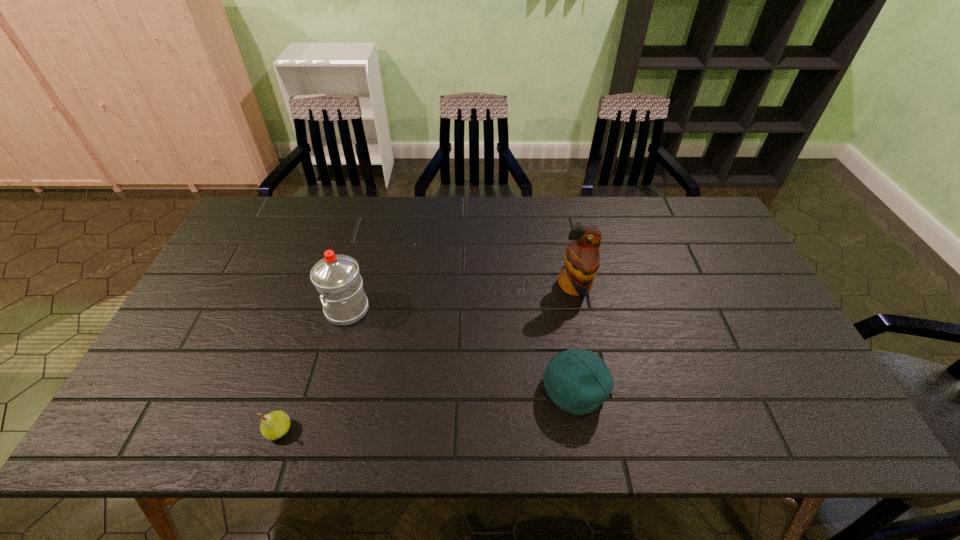
The width and height of the screenshot is (960, 540). In order to click on beanie located at the near edge in this screenshot , I will do `click(578, 381)`.

You are a GUI agent. You are given a task and a screenshot of the screen. Output one action in this format:
    pyautogui.click(x=<x>, y=<y>)
    Task: Click on the pear located at the near edge
    The width and height of the screenshot is (960, 540).
    Given the screenshot: What is the action you would take?
    pyautogui.click(x=276, y=424)

Image resolution: width=960 pixels, height=540 pixels. In order to click on vacant region at the far edge in this screenshot , I will do `click(597, 226)`.

In the image, there is a desktop. At what (x,y) coordinates should I click in order to perform the action: click on blank space at the near edge. Please return your answer as a coordinate pair (x, y). Looking at the image, I should click on (529, 407).

Locate an element on the screen. free space at the left edge of the desktop is located at coordinates (202, 332).

The image size is (960, 540). I want to click on free space at the right edge, so click(x=791, y=382).

Where is `free space at the far left corner`? Image resolution: width=960 pixels, height=540 pixels. free space at the far left corner is located at coordinates (288, 201).

Where is `vacant area between the beanie and the water bottle`? The height and width of the screenshot is (540, 960). vacant area between the beanie and the water bottle is located at coordinates (461, 349).

Where is `blank region between the shortest object and the water bottle`? blank region between the shortest object and the water bottle is located at coordinates (313, 370).

The height and width of the screenshot is (540, 960). Identify the location of vacant point located between the shortest object and the beanie. (426, 409).